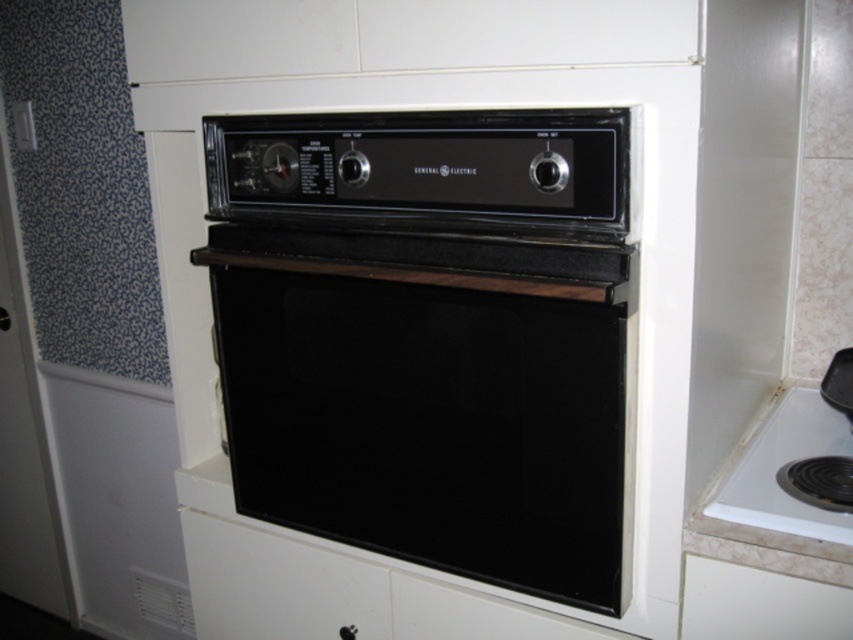
Does black glass oven at center have a lesser width compared to white glossy cooktop at lower right?

In fact, black glass oven at center might be wider than white glossy cooktop at lower right.

Is black glass oven at center bigger than white glossy cooktop at lower right?

Yes.

This screenshot has height=640, width=853. Describe the element at coordinates (431, 397) in the screenshot. I see `black glass oven at center` at that location.

The height and width of the screenshot is (640, 853). In order to click on black glass oven at center in this screenshot , I will do `click(431, 397)`.